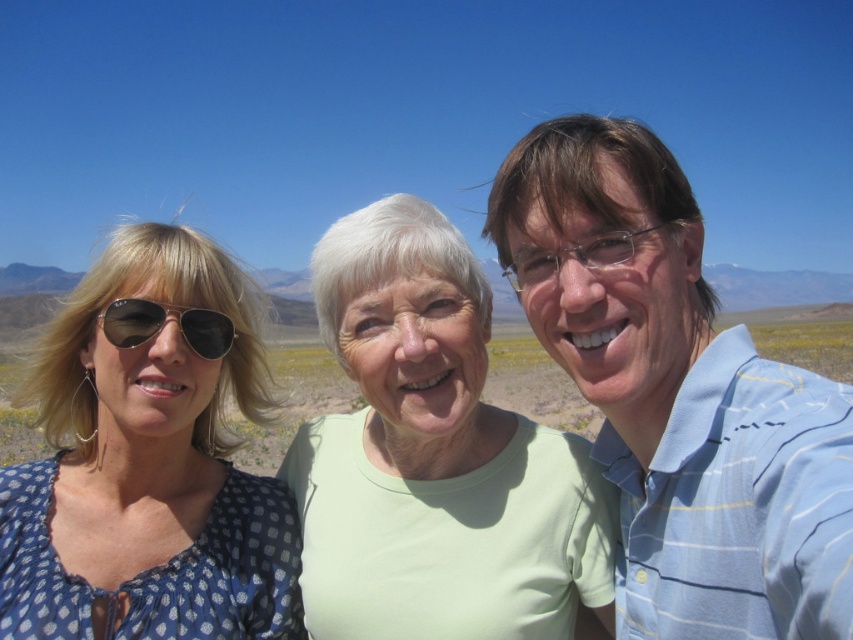
Question: Which of the following is the farthest from the observer?

Choices:
 (A) (751, 445)
 (B) (202, 352)

Answer: (B)

Question: Which object is farther from the camera taking this photo?

Choices:
 (A) light green fabric at center
 (B) light blue striped shirt at right
 (C) matte black goggles at left

Answer: (A)

Question: From the image, what is the correct spatial relationship of light green fabric at center in relation to matte black goggles at left?

Choices:
 (A) right
 (B) left

Answer: (A)

Question: Is light blue striped shirt at right bigger than blue dotted blouse at left?

Choices:
 (A) no
 (B) yes

Answer: (A)

Question: Among these objects, which one is farthest from the camera?

Choices:
 (A) light blue striped shirt at right
 (B) light green fabric at center

Answer: (B)

Question: Considering the relative positions of light blue striped shirt at right and matte black goggles at left in the image provided, where is light blue striped shirt at right located with respect to matte black goggles at left?

Choices:
 (A) right
 (B) left

Answer: (A)